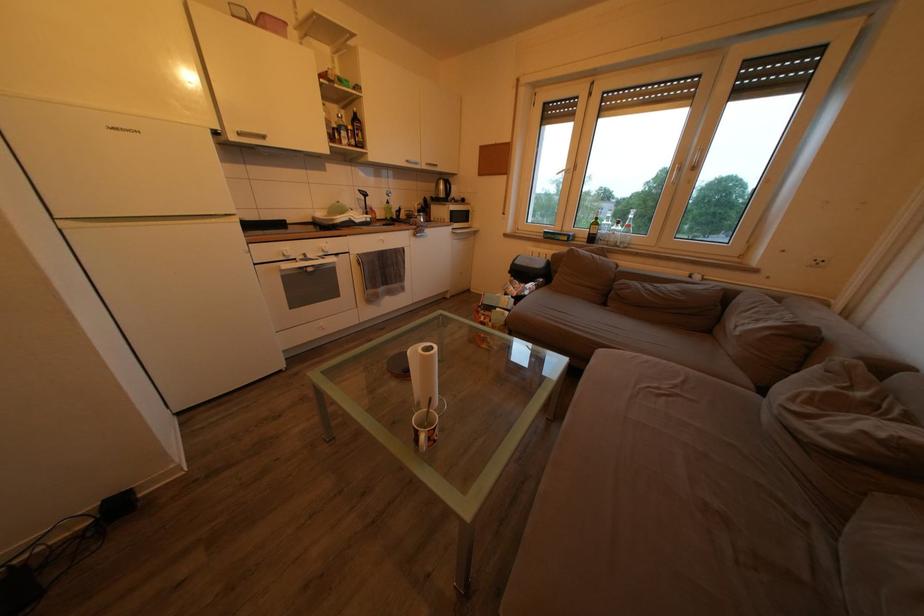
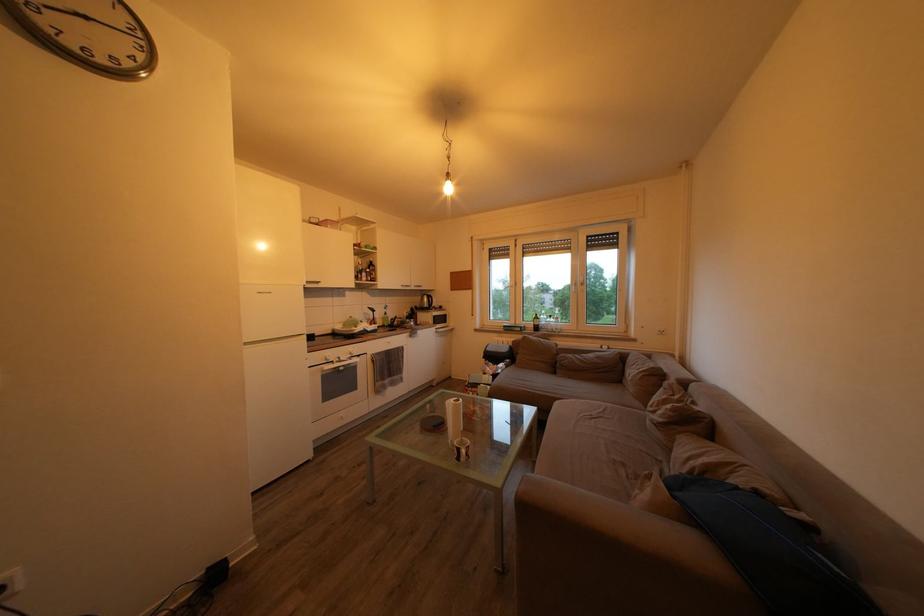
Locate, in the second image, the point that corresponds to (372,201) in the first image.

(381, 317)